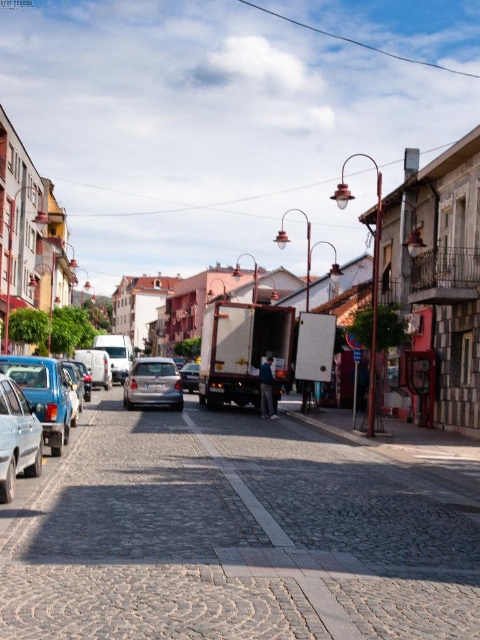
Question: Considering the real-world distances, which object is farthest from the metallic silver car at lower left?

Choices:
 (A) white glossy truck at center
 (B) satin silver car at center

Answer: (A)

Question: From the image, what is the correct spatial relationship of metallic silver car at lower left in relation to satin silver car at center?

Choices:
 (A) below
 (B) above

Answer: (B)

Question: Among these objects, which one is nearest to the camera?

Choices:
 (A) metallic silver car at lower left
 (B) white glossy truck at center
 (C) matte blue car at center-left
 (D) satin silver car at center

Answer: (A)

Question: Based on their relative distances, which object is nearer to the matte silver sedan at center?

Choices:
 (A) matte blue car at center-left
 (B) white glossy truck at center

Answer: (A)

Question: Can you confirm if matte blue car at center-left is bigger than matte silver sedan at center?

Choices:
 (A) yes
 (B) no

Answer: (A)

Question: Can you confirm if white glossy truck at center is positioned above satin silver car at center?

Choices:
 (A) no
 (B) yes

Answer: (B)